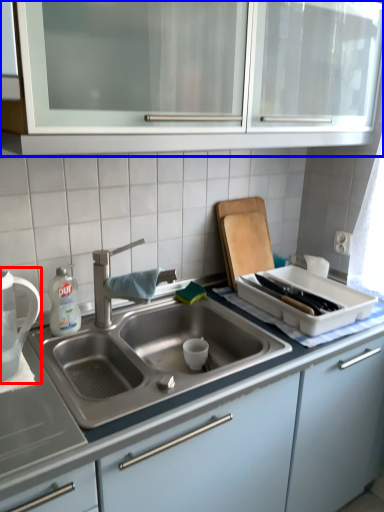
Question: Which point is further to the camera, tea pot (highlighted by a red box) or cabinetry (highlighted by a blue box)?

Choices:
 (A) tea pot
 (B) cabinetry

Answer: (A)